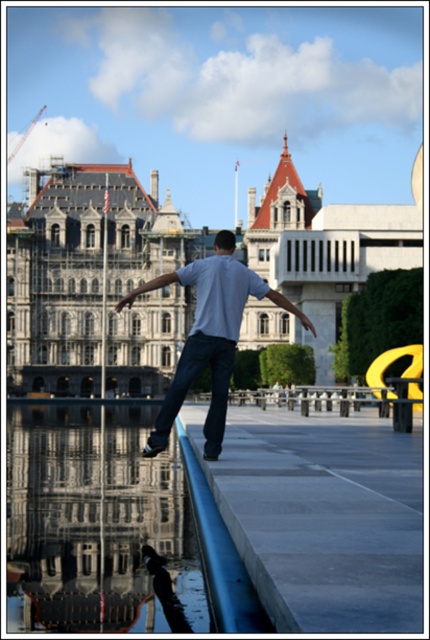
Who is taller, clear glass water at lower left or denim jeans at center?

Standing taller between the two is denim jeans at center.

Between clear glass water at lower left and denim jeans at center, which one appears on the right side from the viewer's perspective?

Positioned to the right is denim jeans at center.

Is point (79, 412) behind point (154, 438)?

Yes.

Identify the location of clear glass water at lower left. The image size is (430, 640). (95, 522).